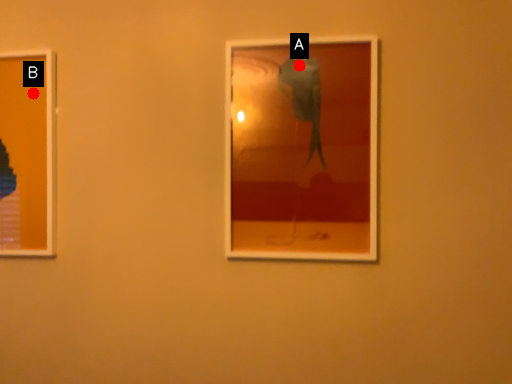
Question: Two points are circled on the image, labeled by A and B beside each circle. Among these points, which one is farthest from the camera?

Choices:
 (A) A is further
 (B) B is further

Answer: (B)